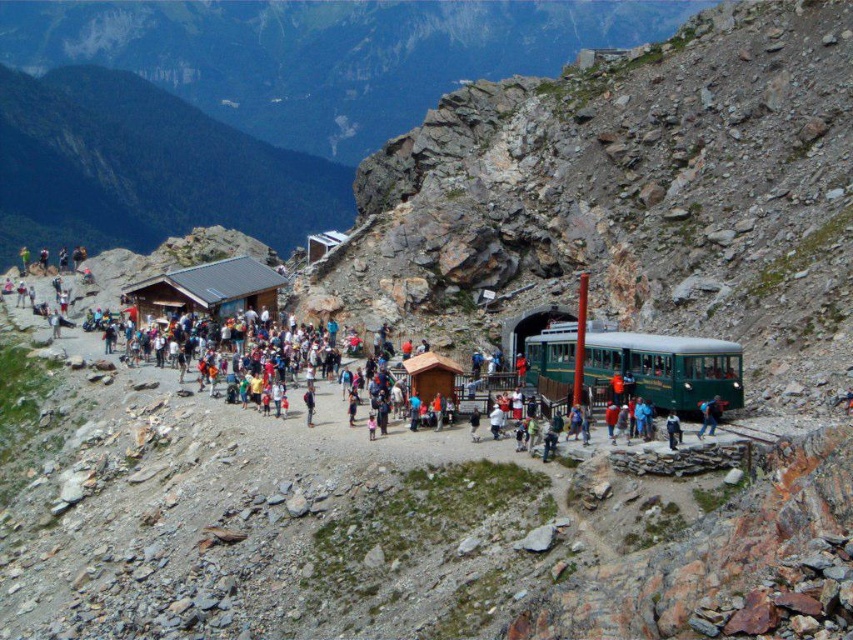
Does green polished wood passenger train at center-right have a lesser width compared to green fabric jacket at lower right?

In fact, green polished wood passenger train at center-right might be wider than green fabric jacket at lower right.

Which is behind, point (534, 355) or point (703, 433)?

The point (534, 355) is more distant.

The image size is (853, 640). Find the location of `green polished wood passenger train at center-right`. green polished wood passenger train at center-right is located at coordinates (665, 369).

Is point (607, 368) closer to camera compared to point (312, 388)?

Yes, point (607, 368) is closer to viewer.

Based on the photo, how much distance is there between green polished wood passenger train at center-right and light blue denim jeans at center?

A distance of 21.14 meters exists between green polished wood passenger train at center-right and light blue denim jeans at center.

What do you see at coordinates (665, 369) in the screenshot? Image resolution: width=853 pixels, height=640 pixels. I see `green polished wood passenger train at center-right` at bounding box center [665, 369].

Where is `green polished wood passenger train at center-right`? The image size is (853, 640). green polished wood passenger train at center-right is located at coordinates (665, 369).

Is green fabric jacket at lower right further to the viewer compared to light blue denim jeans at center?

No, green fabric jacket at lower right is in front of light blue denim jeans at center.

Is point (706, 429) more distant than point (309, 392)?

No, (706, 429) is closer to viewer.

Is point (714, 397) less distant than point (306, 412)?

Yes, it is in front of point (306, 412).

This screenshot has width=853, height=640. What are the coordinates of `green fabric jacket at lower right` in the screenshot? It's located at (708, 416).